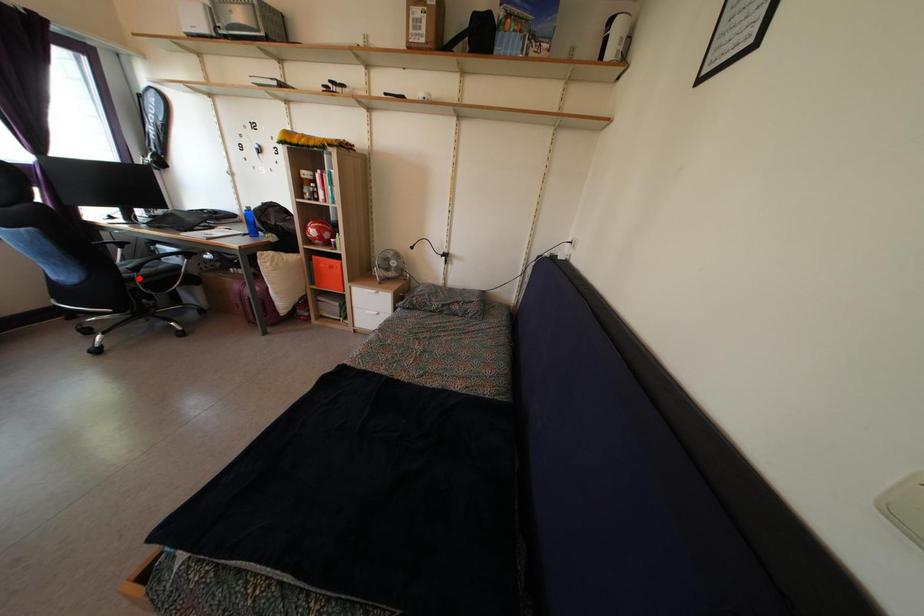
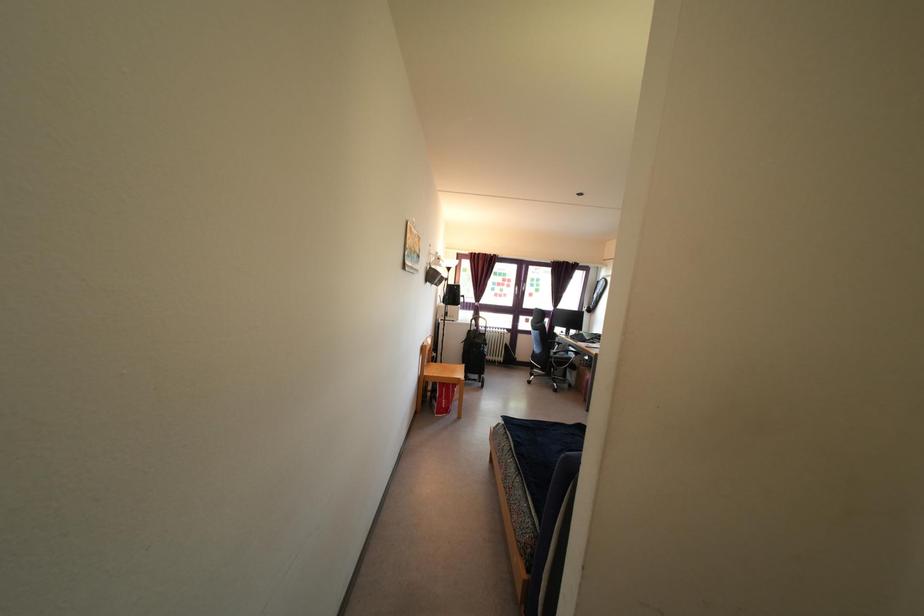
Locate, in the second image, the point that corresponds to the highlighted location in the first image.

(557, 362)